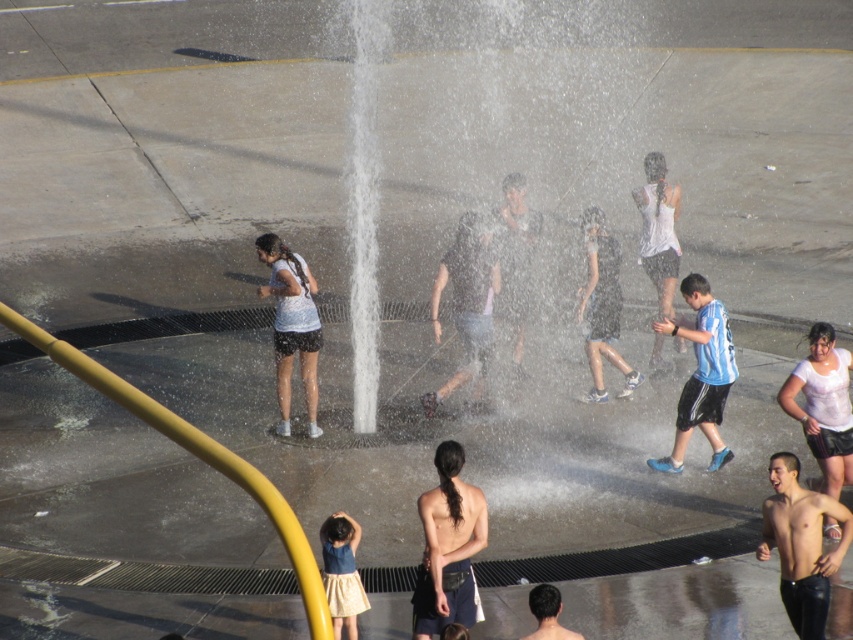
Question: Does smooth skin torso at lower right have a larger size compared to white matte shorts at center?

Choices:
 (A) yes
 (B) no

Answer: (B)

Question: Is white matte shorts at center to the left of smooth skin head at center from the viewer's perspective?

Choices:
 (A) yes
 (B) no

Answer: (A)

Question: Which point is farther from the camera taking this photo?

Choices:
 (A) (543, 637)
 (B) (303, 324)

Answer: (B)

Question: Which object appears farthest from the camera in this image?

Choices:
 (A) denim skirt at lower center
 (B) smooth skin torso at lower right
 (C) dark gray fabric shirt at center
 (D) smooth skin head at center

Answer: (C)

Question: Among these points, which one is farthest from the camera?

Choices:
 (A) (437, 532)
 (B) (334, 541)
 (C) (827, 520)

Answer: (C)

Question: Is white matte shorts at center bigger than smooth skin head at center?

Choices:
 (A) yes
 (B) no

Answer: (A)